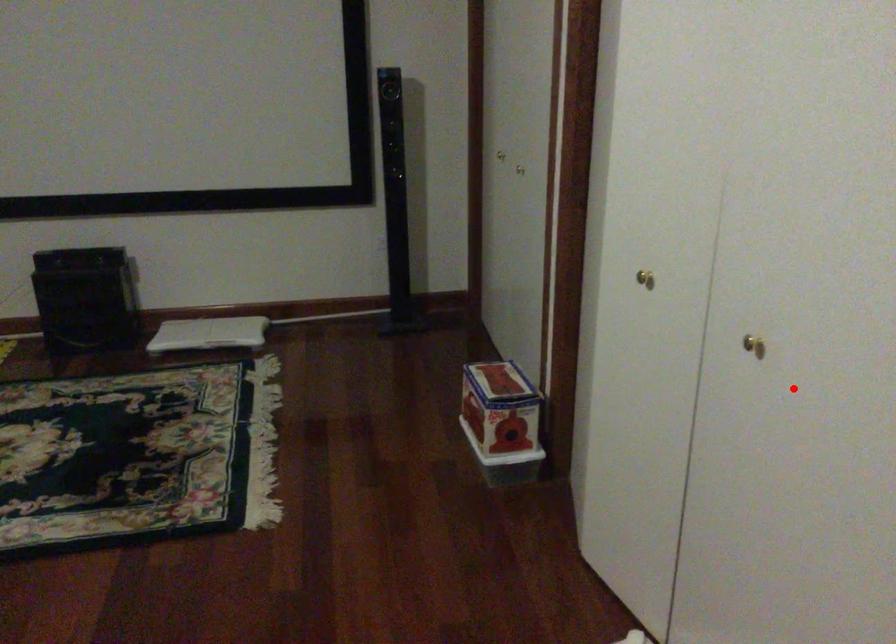
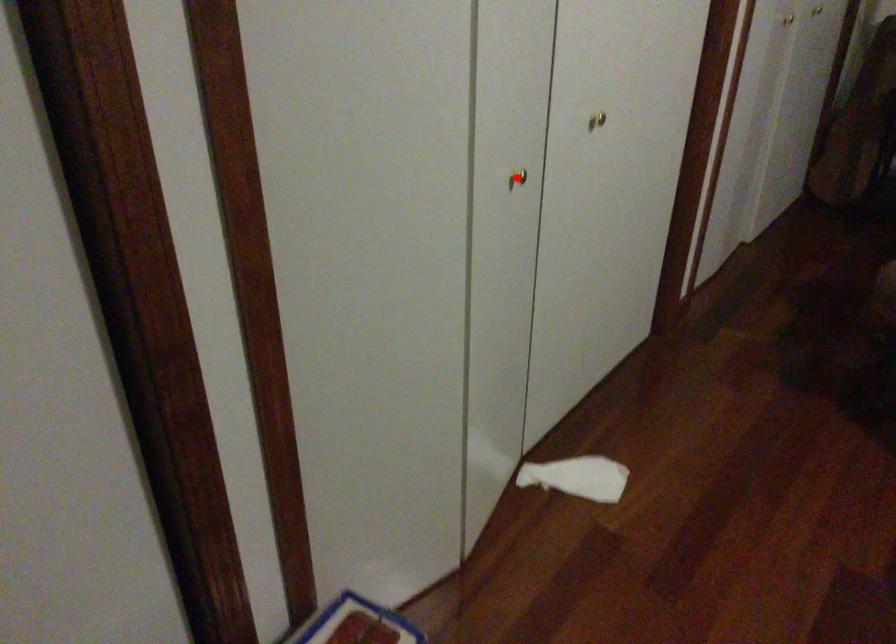
I am providing you with two images of the same scene from different viewpoints. A red point is marked on the first image and another point is marked on the second image. Are the points marked in image1 and image2 representing the same 3D position?

No